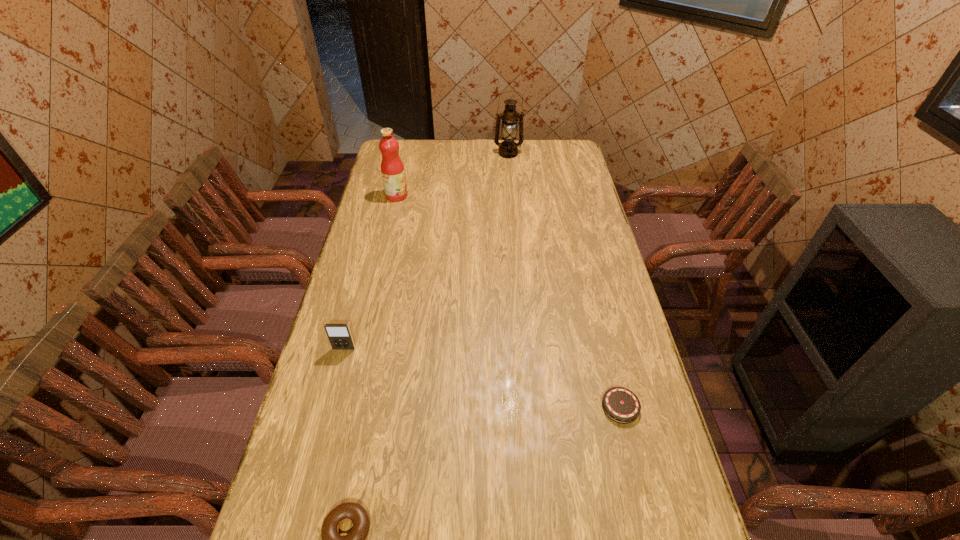
Locate an element on the screen. The width and height of the screenshot is (960, 540). oil lamp is located at coordinates (508, 148).

Where is `the second object from right to left`? the second object from right to left is located at coordinates (508, 148).

Locate an element on the screen. the fourth nearest object is located at coordinates (392, 168).

You are a GUI agent. You are given a task and a screenshot of the screen. Output one action in this format:
    pyautogui.click(x=<x>, y=<y>)
    Task: Click on the iPod
    
    Given the screenshot: What is the action you would take?
    pyautogui.click(x=339, y=335)

Image resolution: width=960 pixels, height=540 pixels. In order to click on the third shortest object in this screenshot , I will do `click(339, 335)`.

Locate an element on the screen. chocolate cake is located at coordinates (621, 405).

Where is `the rightmost object`? The width and height of the screenshot is (960, 540). the rightmost object is located at coordinates (621, 405).

At what (x,y) coordinates should I click in order to perform the action: click on vacant space located on the back of the oil lamp. Please return your answer as a coordinate pair (x, y). The height and width of the screenshot is (540, 960). Looking at the image, I should click on (508, 144).

In order to click on free space located 0.270m on the front label of the fruit juice in this screenshot , I will do tap(471, 195).

You are a GUI agent. You are given a task and a screenshot of the screen. Output one action in this format:
    pyautogui.click(x=<x>, y=<y>)
    Task: Click on the free space located 0.080m on the front-facing side of the third nearest object
    This screenshot has height=540, width=960.
    Given the screenshot: What is the action you would take?
    pyautogui.click(x=338, y=373)